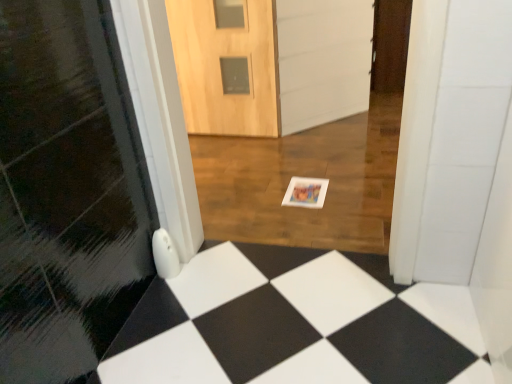
Where is `white matte postcard at center`? The image size is (512, 384). white matte postcard at center is located at coordinates (306, 192).

This screenshot has height=384, width=512. Describe the element at coordinates (306, 192) in the screenshot. I see `white matte postcard at center` at that location.

What do you see at coordinates (226, 65) in the screenshot? This screenshot has height=384, width=512. I see `wooden door at center` at bounding box center [226, 65].

In order to face wooden door at center, should I rotate leftwards or rightwards?

You should look left and rotate roughly 4.572 degrees.

Identify the location of wooden door at center. The width and height of the screenshot is (512, 384). (226, 65).

This screenshot has width=512, height=384. Find the location of `white matte postcard at center`. white matte postcard at center is located at coordinates (306, 192).

Consider the image. Which object is positioned more to the right, wooden door at center or white matte postcard at center?

white matte postcard at center is more to the right.

Is wooden door at center in front of or behind white matte postcard at center in the image?

Clearly, wooden door at center is behind white matte postcard at center.

Is point (213, 40) closer or farther from the camera than point (315, 189)?

Clearly, point (213, 40) is more distant from the camera than point (315, 189).

From the image's perspective, between wooden door at center and white matte postcard at center, which one is located above?

wooden door at center is shown above in the image.

From a real-world perspective, is wooden door at center under white matte postcard at center?

No, from a real-world perspective, wooden door at center is not under white matte postcard at center.

Is wooden door at center wider than white matte postcard at center?

Incorrect, the width of wooden door at center does not surpass that of white matte postcard at center.

Can you confirm if wooden door at center is shorter than white matte postcard at center?

No.

In terms of size, does wooden door at center appear bigger or smaller than white matte postcard at center?

In the image, wooden door at center appears to be larger than white matte postcard at center.

In the scene shown: Would you say wooden door at center is outside white matte postcard at center?

Indeed, wooden door at center is completely outside white matte postcard at center.

Does wooden door at center touch white matte postcard at center?

There is a gap between wooden door at center and white matte postcard at center.

Could you tell me if wooden door at center is facing white matte postcard at center?

No.

Measure the distance from wooden door at center to white matte postcard at center.

wooden door at center and white matte postcard at center are 36.64 inches apart.

I want to click on postcard directly beneath the wooden door at center (from a real-world perspective), so click(306, 192).

Considering the positions of objects white matte postcard at center and wooden door at center in the image provided, who is more to the right, white matte postcard at center or wooden door at center?

white matte postcard at center is more to the right.

Considering their positions, is white matte postcard at center located in front of or behind wooden door at center?

Clearly, white matte postcard at center is in front of wooden door at center.

Does point (287, 199) come behind point (231, 78)?

No, it is in front of (231, 78).

From the image's perspective, does white matte postcard at center appear higher than wooden door at center?

No, from the image's perspective, white matte postcard at center is not above wooden door at center.

From a real-world perspective, is white matte postcard at center positioned above or below wooden door at center?

Clearly, from a real-world perspective, white matte postcard at center is below wooden door at center.

In terms of width, does white matte postcard at center look wider or thinner when compared to wooden door at center?

Considering their sizes, white matte postcard at center looks broader than wooden door at center.

Which of these two, white matte postcard at center or wooden door at center, stands shorter?

Standing shorter between the two is white matte postcard at center.

Considering the sizes of white matte postcard at center and wooden door at center in the image, is white matte postcard at center bigger or smaller than wooden door at center?

Considering their sizes, white matte postcard at center takes up less space than wooden door at center.

Is wooden door at center located within white matte postcard at center?

No.

Is white matte postcard at center next to wooden door at center and touching it?

No.

Is white matte postcard at center facing away from wooden door at center?

No, wooden door at center is not at the back of white matte postcard at center.

How many degrees apart are the facing directions of white matte postcard at center and wooden door at center?

The angular difference between white matte postcard at center and wooden door at center is 3.07 degrees.

What are the coordinates of `postcard that appears below the wooden door at center (from the image's perspective)` in the screenshot? It's located at (306, 192).

Identify the location of door above the white matte postcard at center (from the image's perspective). (226, 65).

Identify the location of postcard on the right of wooden door at center. (306, 192).